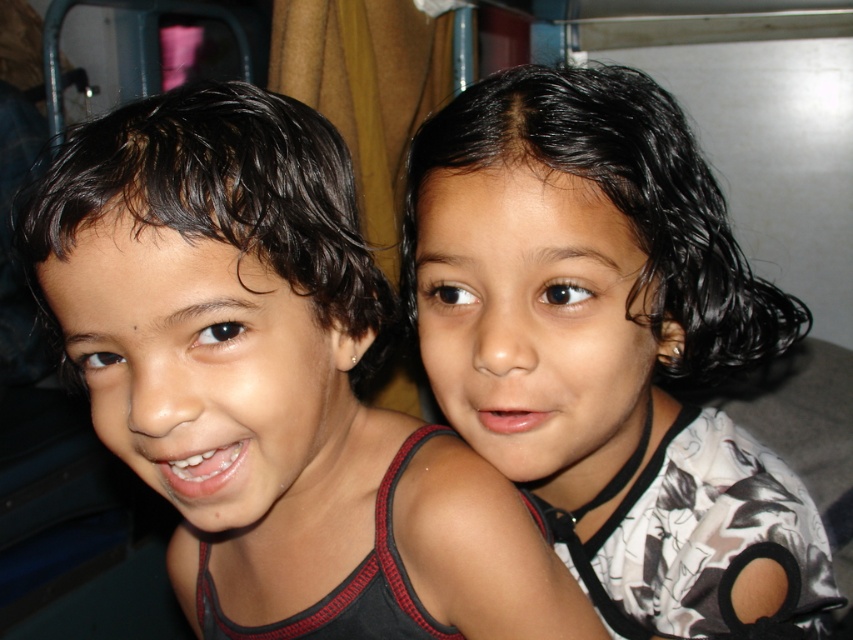
You are a photographer trying to capture the scene where the two children are sitting. You notice a specific point in the image at coordinates (271, 384). What object is located at this point?

The point at coordinates (271, 384) corresponds to the matte black tank top at left.

You are a photographer trying to focus on the matte black tank top at left and the black matte hair at upper right. Which object should you adjust your camera to focus on first if you want to capture both in sharp detail?

The matte black tank top at left is in front of the black matte hair at upper right, so you should focus on the matte black tank top at left first to ensure both are in focus.

You are a photographer trying to capture a closeup of the matte black tank top at left and the black matte hair at upper right. Since you can only focus on one subject at a time, which one should you focus on first if you want to ensure both are in focus without moving the camera?

You should focus on the matte black tank top at left first because it is closer to the camera than the black matte hair at upper right. By focusing on the closer subject, the farther one will also be in focus due to the depth of field.